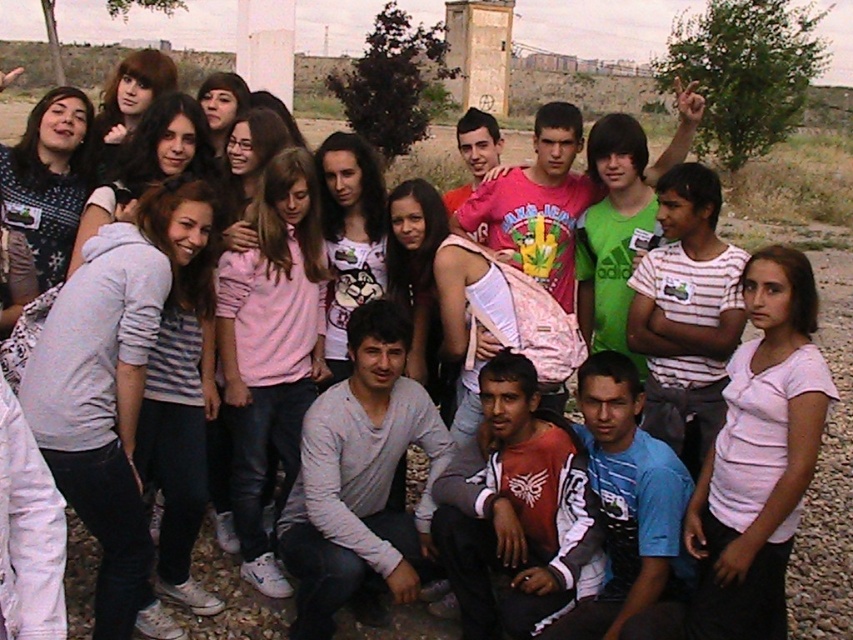
Can you confirm if matte red shirt at center is wider than white striped shirt at center?

Yes, matte red shirt at center is wider than white striped shirt at center.

Who is positioned more to the right, matte red shirt at center or white striped shirt at center?

Positioned to the right is white striped shirt at center.

Who is more distant from viewer, (465, 515) or (664, 362)?

The point (664, 362) is more distant.

Where is `matte red shirt at center`? The width and height of the screenshot is (853, 640). matte red shirt at center is located at coordinates (517, 513).

Who is higher up, light gray sweater at center or matte red shirt at center?

light gray sweater at center

Is light gray sweater at center positioned behind matte red shirt at center?

That is False.

Is point (288, 566) closer to camera compared to point (548, 470)?

That is True.

Identify the location of light gray sweater at center. (360, 481).

Which is more to the left, gray hoodie at left or blue cotton shirt at center?

gray hoodie at left

The width and height of the screenshot is (853, 640). Describe the element at coordinates (111, 380) in the screenshot. I see `gray hoodie at left` at that location.

Locate an element on the screen. The image size is (853, 640). gray hoodie at left is located at coordinates (111, 380).